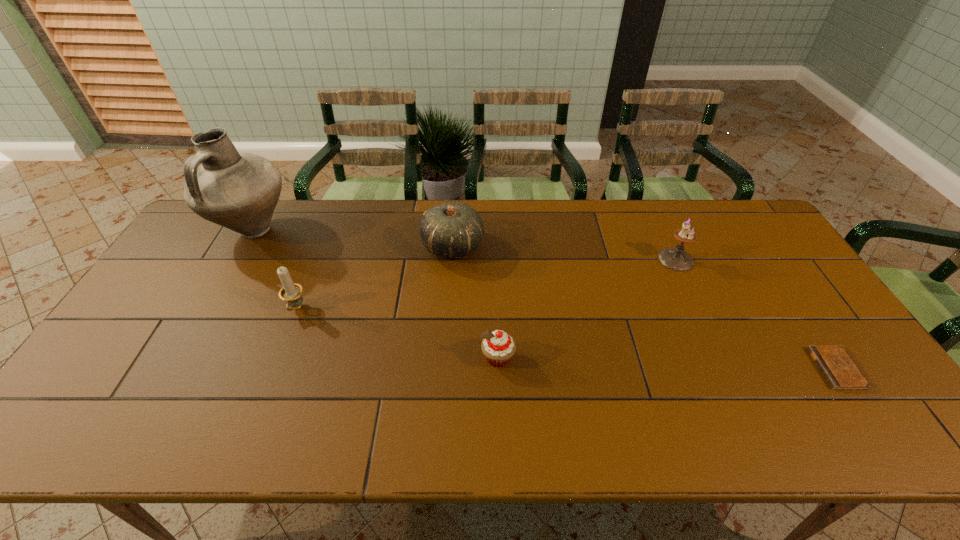
Find the location of a particular element. This screenshot has width=960, height=540. free space that is in between the nearer candle_holder and the second shortest object is located at coordinates (397, 333).

Locate an element on the screen. This screenshot has height=540, width=960. empty location between the fourth farthest object and the fifth object from left to right is located at coordinates (486, 284).

Where is `free space between the cupcake and the third nearest object`? The width and height of the screenshot is (960, 540). free space between the cupcake and the third nearest object is located at coordinates (397, 333).

The width and height of the screenshot is (960, 540). What are the coordinates of `free space between the rightmost object and the left candle_holder` in the screenshot? It's located at (566, 339).

This screenshot has height=540, width=960. Identify the location of empty space between the second shortest object and the tallest object. (375, 294).

Find the location of `vacant space that is in between the fourth farthest object and the cupcake`. vacant space that is in between the fourth farthest object and the cupcake is located at coordinates (397, 333).

I want to click on free area in between the diary and the gourd, so click(644, 307).

You are a GUI agent. You are given a task and a screenshot of the screen. Output one action in this format:
    pyautogui.click(x=<x>, y=<y>)
    Task: Click on the object that stands as the fifth closest to the gourd
    
    Given the screenshot: What is the action you would take?
    pyautogui.click(x=839, y=370)

Identify the location of object that is the closest to the leftmost object. The image size is (960, 540). (291, 292).

This screenshot has width=960, height=540. I want to click on free space in the image that satisfies the following two spatial constraints: 1. on the handle side of the second shortest object; 2. on the right side of the leftmost object, so click(180, 358).